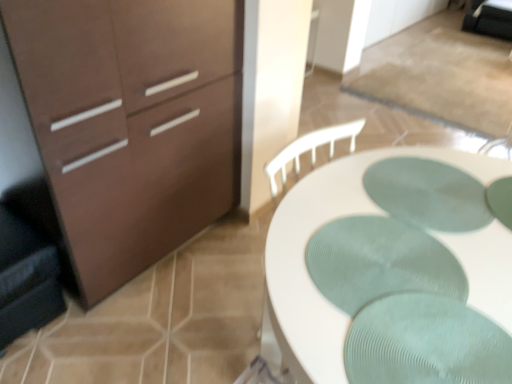
The width and height of the screenshot is (512, 384). Find the location of `empty space that is in between green textured placemat at center, marked as the 2th oval in a bottom-to-top arrangement, and green ribbed placemat at center, the second oval from the top`. empty space that is in between green textured placemat at center, marked as the 2th oval in a bottom-to-top arrangement, and green ribbed placemat at center, the second oval from the top is located at coordinates (413, 231).